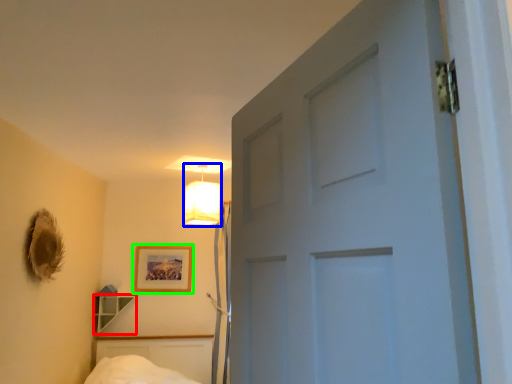
Question: Which object is the closest to the shelf (highlighted by a red box)? Choose among these: lamp (highlighted by a blue box) or picture frame (highlighted by a green box).

Choices:
 (A) lamp
 (B) picture frame

Answer: (B)